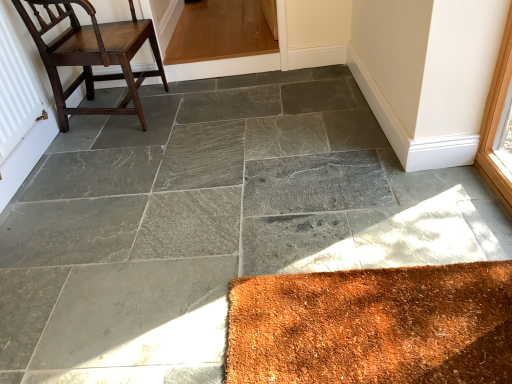
At what (x,y) coordinates should I click in order to perform the action: click on free space in front of dark brown wood chair at left. Please return your answer as a coordinate pair (x, y). The width and height of the screenshot is (512, 384). Looking at the image, I should click on [119, 153].